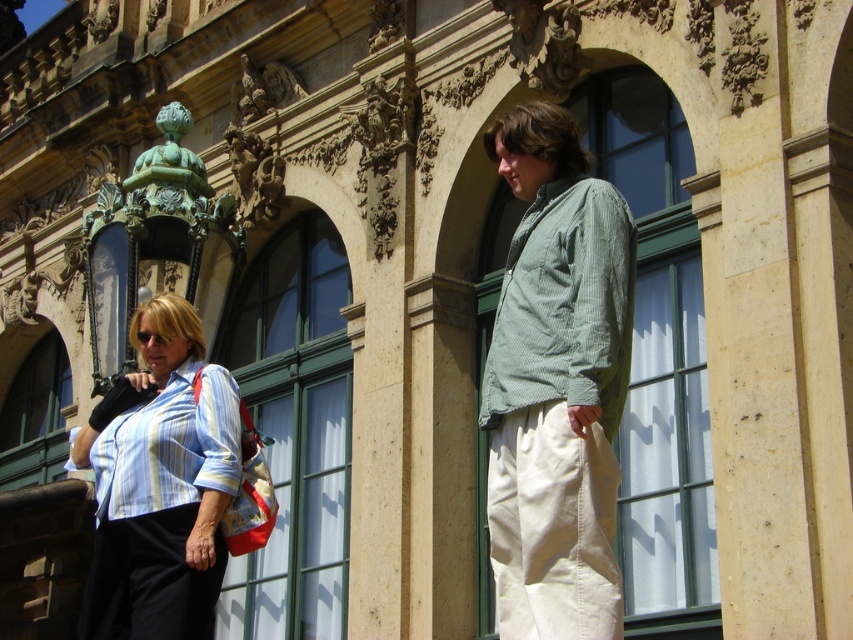
You are a fashion designer observing two shirts in the scene. The striped cotton shirt at left and the green corduroy shirt at upper right. Which one has a greater width?

The striped cotton shirt at left has a greater width than the green corduroy shirt at upper right according to the description.

Based on the photo, based on the scene description, which of the two shirts, the green corduroy shirt at upper right or the striped cotton shirt at lower left, is taller?

Answer: The green corduroy shirt at upper right is taller than the striped cotton shirt at lower left according to the description.

You are standing at the position of the person with the striped cotton shirt at left. The other person is standing 102.60 feet away. If you want to throw a ball to them, would you need to aim higher or lower than usual?

The other person is 102.60 feet away from the striped cotton shirt at left. To throw a ball that far, you would need to aim higher than usual to ensure it reaches them.